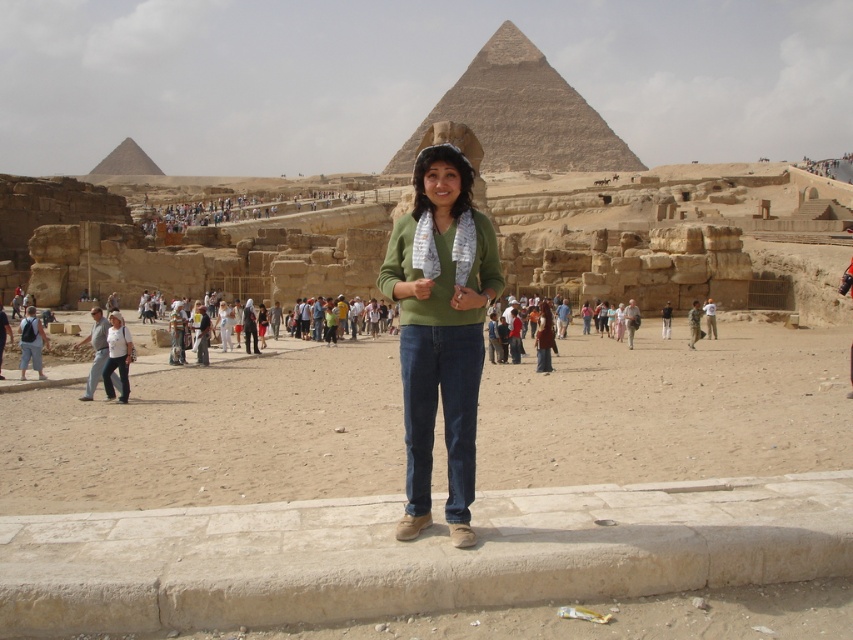
The image size is (853, 640). What do you see at coordinates (521, 115) in the screenshot? I see `brown stone pyramid at center` at bounding box center [521, 115].

From the picture: Measure the distance between brown stone pyramid at center and camera.

brown stone pyramid at center and camera are 417.69 meters apart.

Where is `brown stone pyramid at center`? Image resolution: width=853 pixels, height=640 pixels. brown stone pyramid at center is located at coordinates (521, 115).

Which is below, dark blue jeans at left or camouflage uniform at center?

Positioned lower is dark blue jeans at left.

Consider the image. Does dark blue jeans at left have a greater width compared to camouflage uniform at center?

Yes.

Who is more forward, (44, 340) or (697, 300)?

Point (44, 340) is more forward.

The image size is (853, 640). Identify the location of dark blue jeans at left. (32, 342).

In the scene shown: Between green sweater at center and light blue jeans at center, which one appears on the left side from the viewer's perspective?

green sweater at center

Which is behind, point (303, 211) or point (712, 321)?

The point (303, 211) is more distant.

Describe the element at coordinates (270, 216) in the screenshot. This screenshot has width=853, height=640. I see `green sweater at center` at that location.

Identify the location of green sweater at center. This screenshot has width=853, height=640. (270, 216).